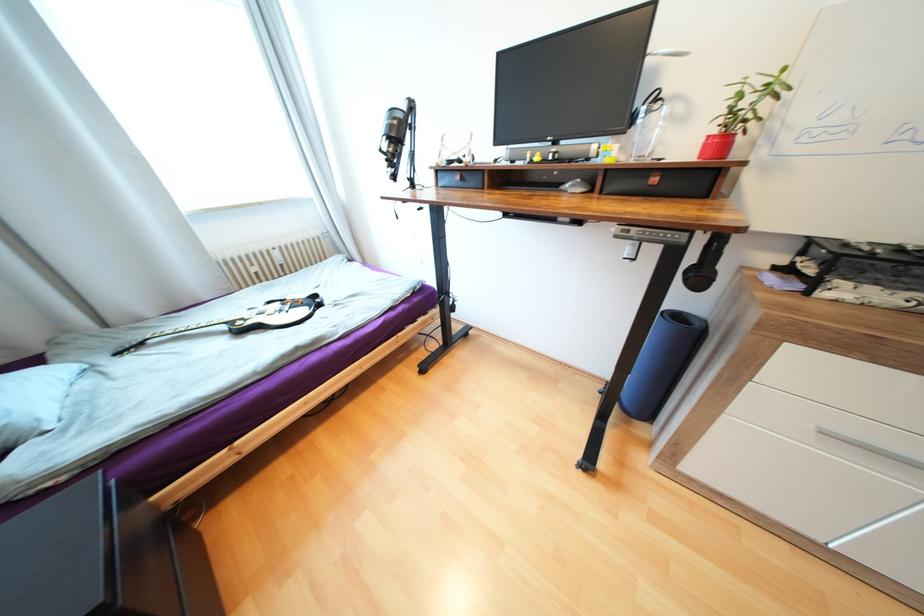
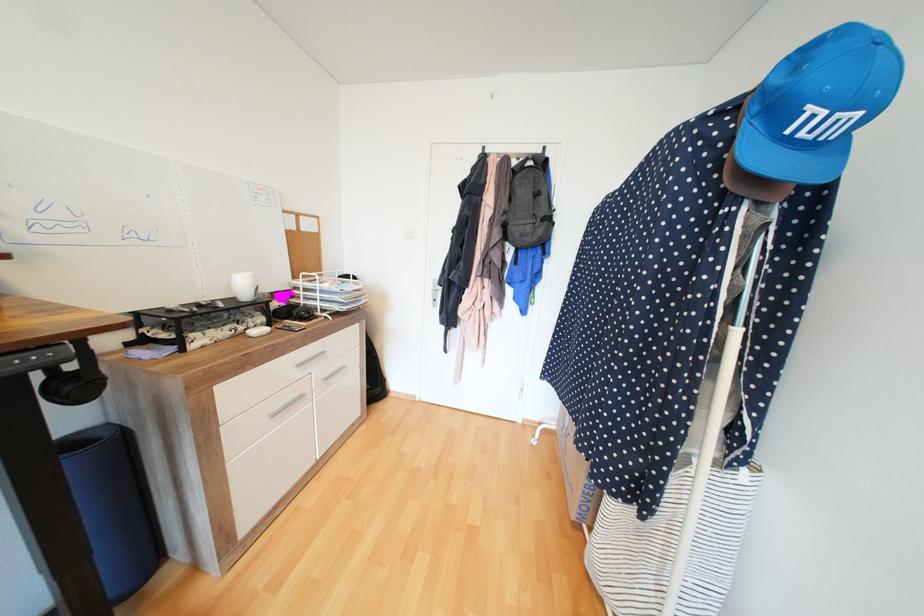
The point at (x=685, y=315) is marked in the first image. Where is the corresponding point in the second image?

(80, 443)